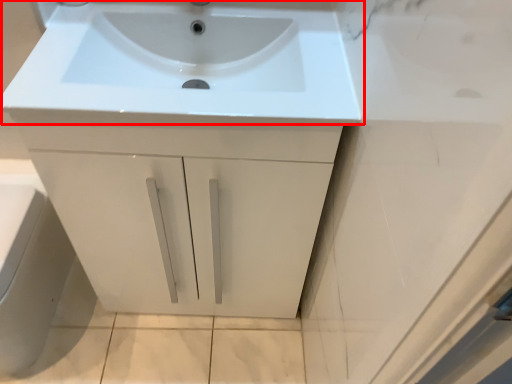
Question: From the image's perspective, what is the correct spatial relationship of sink (annotated by the red box) in relation to porcelain?

Choices:
 (A) below
 (B) above

Answer: (B)